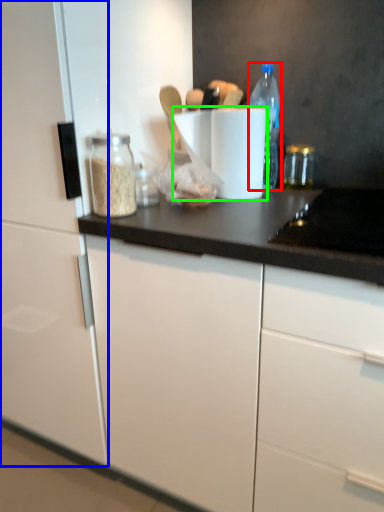
Question: Estimate the real-world distances between objects in this image. Which object is closer to bottle (highlighted by a red box), cabinetry (highlighted by a blue box) or paper towel (highlighted by a green box)?

Choices:
 (A) cabinetry
 (B) paper towel

Answer: (B)